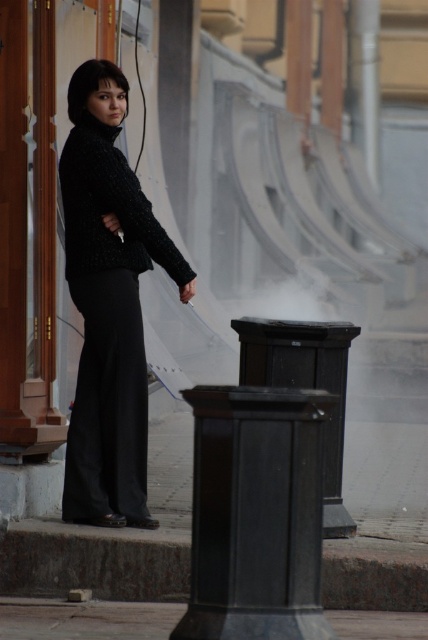
Question: Does black glossy trash can at lower right appear on the right side of smooth concrete pavement at lower center?

Choices:
 (A) no
 (B) yes

Answer: (B)

Question: Which of the following is the closest to the observer?

Choices:
 (A) smooth concrete pavement at lower center
 (B) black matte trash can at lower center
 (C) black glossy trash can at lower right
 (D) matte black sweater at center

Answer: (C)

Question: Which object is the farthest from the black glossy trash can at lower right?

Choices:
 (A) matte black sweater at center
 (B) smooth concrete pavement at lower center

Answer: (A)

Question: Is black matte trash can at lower center above smooth concrete pavement at lower center?

Choices:
 (A) yes
 (B) no

Answer: (A)

Question: Among these points, which one is farthest from the camera?

Choices:
 (A) 282,541
 (B) 362,628
 (C) 300,384
 (D) 97,308

Answer: (D)

Question: Is matte black sweater at center smaller than smooth concrete pavement at lower center?

Choices:
 (A) no
 (B) yes

Answer: (A)